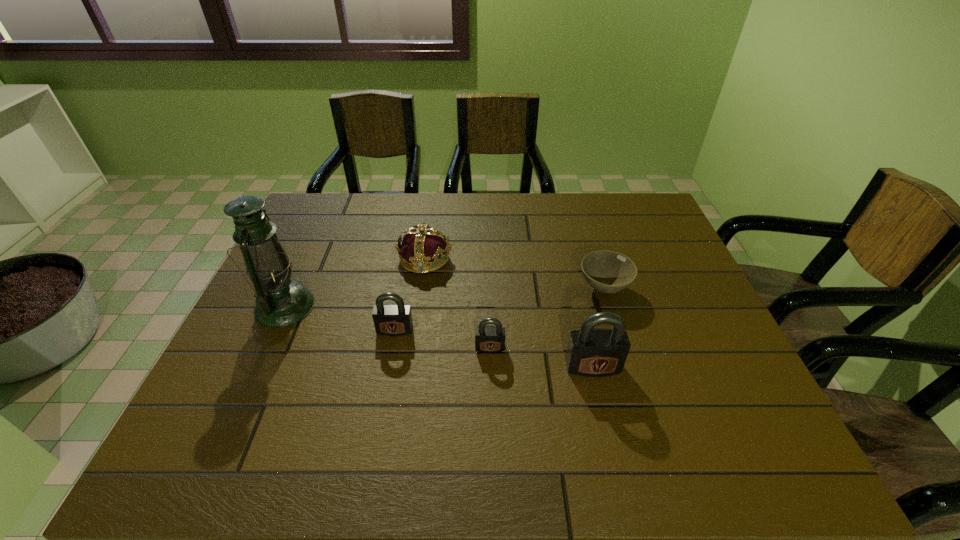
This screenshot has height=540, width=960. What are the coordinates of `vacant region at the far left corner` in the screenshot? It's located at (296, 229).

The width and height of the screenshot is (960, 540). Find the location of `vacant region at the near left corner of the desktop`. vacant region at the near left corner of the desktop is located at coordinates (196, 408).

Where is `vacant space at the far right corner of the desktop`? Image resolution: width=960 pixels, height=540 pixels. vacant space at the far right corner of the desktop is located at coordinates (655, 226).

The height and width of the screenshot is (540, 960). What are the coordinates of `free space between the tallest object and the bowl` in the screenshot? It's located at (444, 298).

At what (x,y) coordinates should I click in order to perform the action: click on blank region between the farthest padlock and the oil lamp. Please return your answer as a coordinate pair (x, y). The image size is (960, 540). Looking at the image, I should click on (340, 318).

Identify the location of free spot between the bowl and the leftmost padlock. Image resolution: width=960 pixels, height=540 pixels. (499, 309).

Find the location of a particular element. This screenshot has height=540, width=960. free spot between the rightmost padlock and the shortest padlock is located at coordinates (541, 357).

At what (x,y) coordinates should I click in order to perform the action: click on empty space between the second tallest padlock and the second nearest object. Please return your answer as a coordinate pair (x, y). The image size is (960, 540). Looking at the image, I should click on (443, 339).

Locate an element on the screen. The width and height of the screenshot is (960, 540). free space between the shortest object and the nearest padlock is located at coordinates (598, 327).

Locate an element on the screen. The height and width of the screenshot is (540, 960). empty space between the leftmost padlock and the shortest padlock is located at coordinates (443, 339).